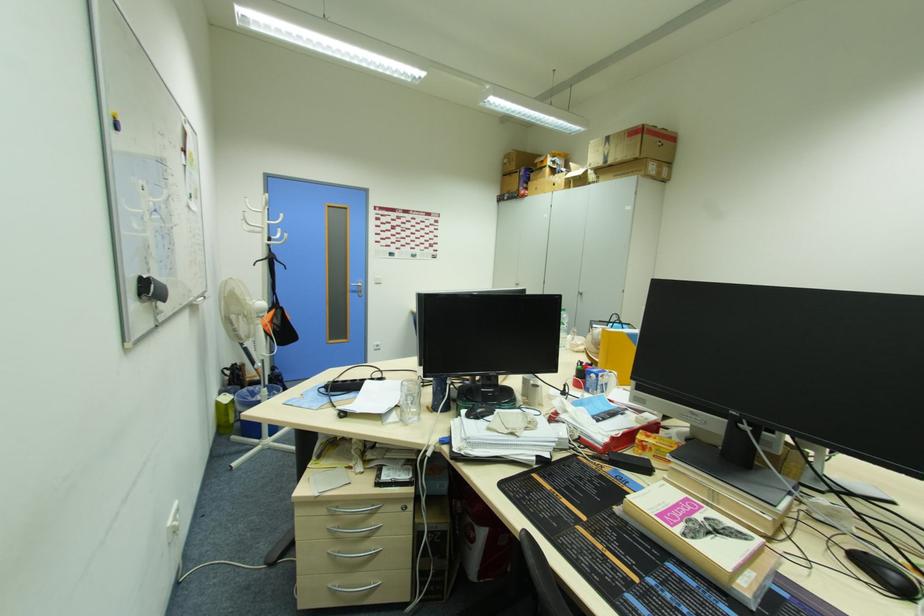
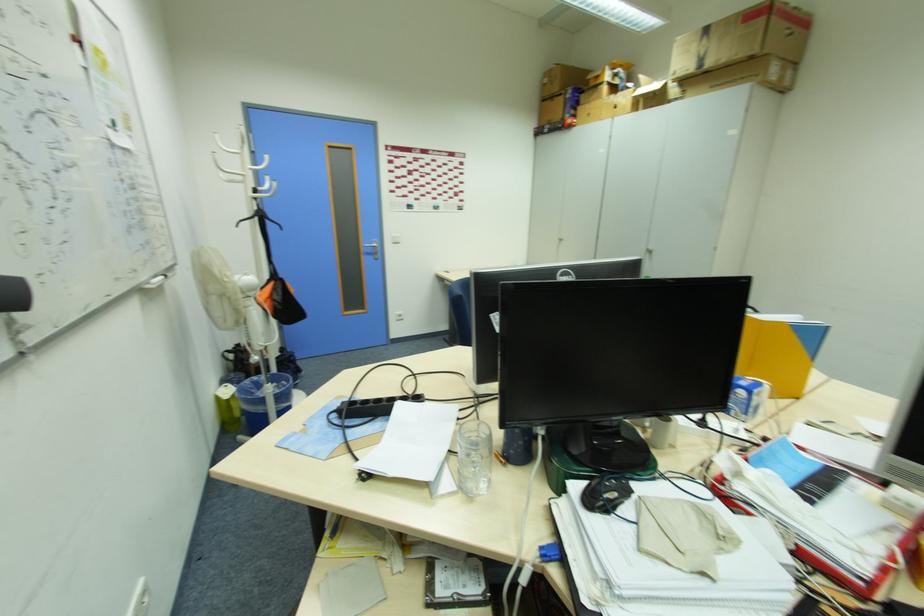
Question: The first image is from the beginning of the video and the second image is from the end. How did the camera likely rotate when shooting the video?

Choices:
 (A) Left
 (B) Right
 (C) Up
 (D) Down

Answer: (D)